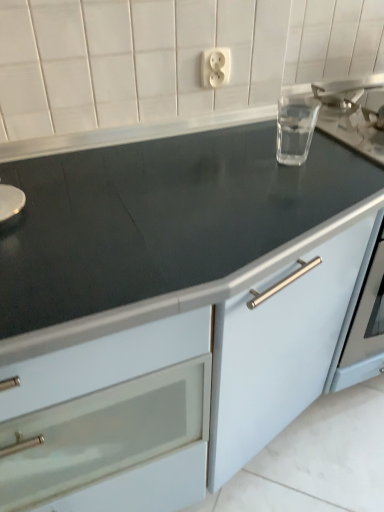
Locate an element on the screen. vacant space that is to the left of transparent glass at upper right is located at coordinates (219, 162).